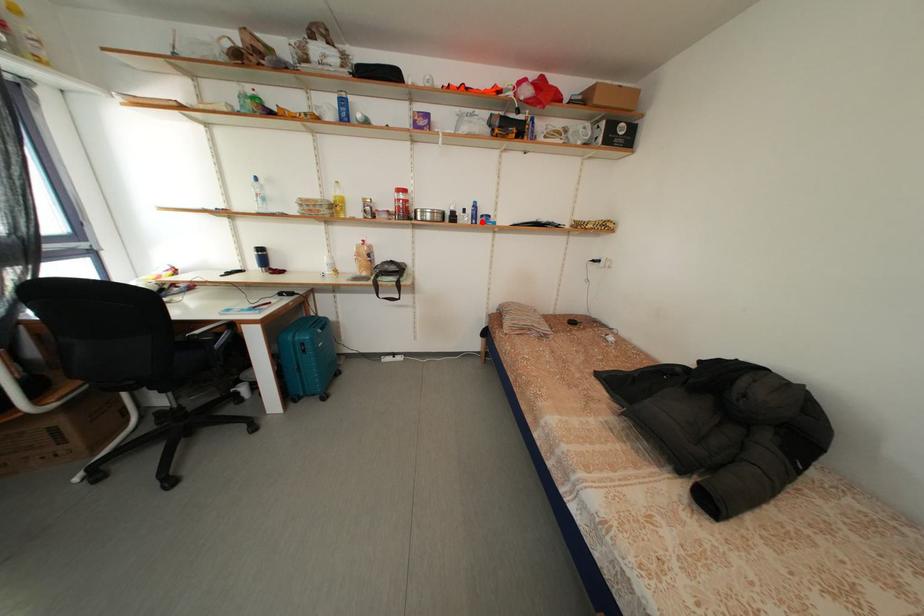
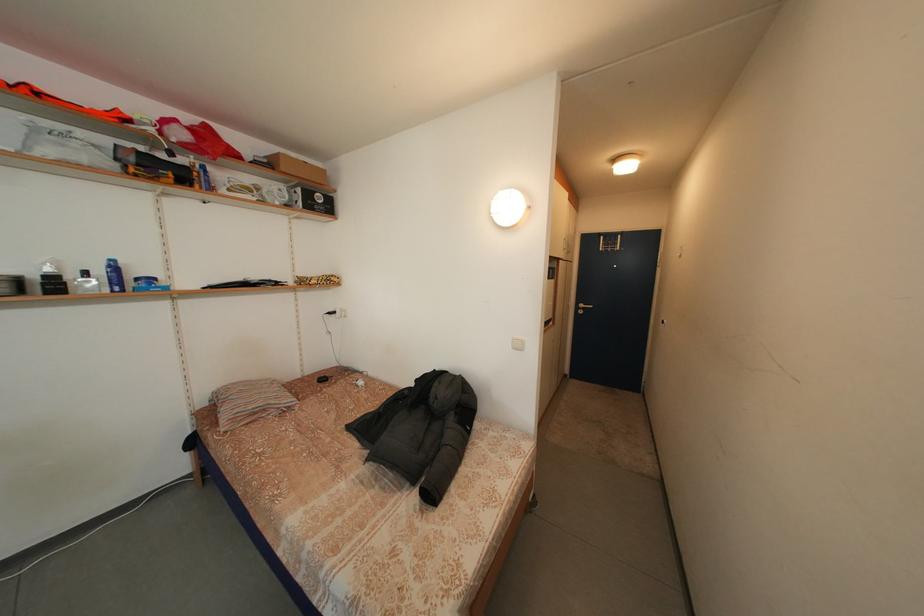
Question: I am providing you with two images of the same scene from different viewpoints. A red point is marked on the first image. At the location where the point appears in image 1, is it still visible in image 2?

Choices:
 (A) Yes
 (B) No

Answer: (A)